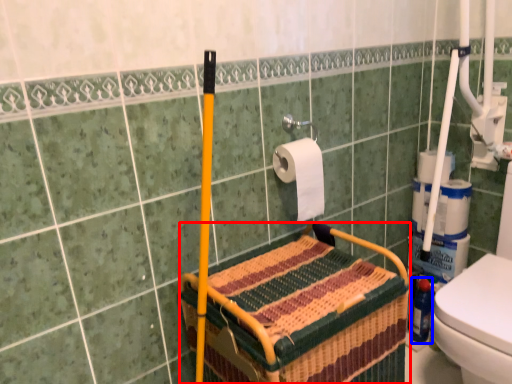
Question: Which object appears closest to the camera in this image, crate (highlighted by a red box) or bottle (highlighted by a blue box)?

Choices:
 (A) crate
 (B) bottle

Answer: (A)